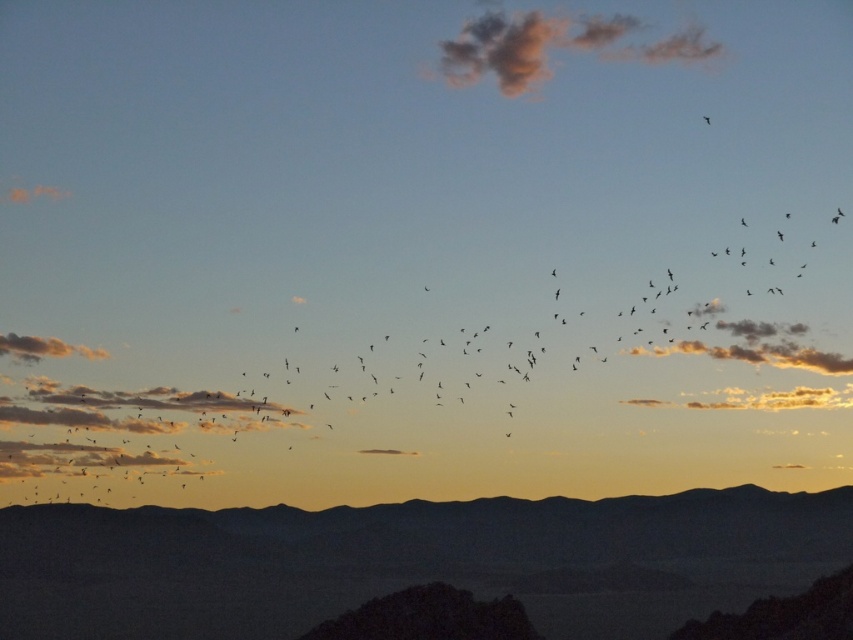
From the picture: You are an artist trying to paint the landscape. You want to ensure the silhouetted rock at lower center and the soft pink cotton cloud at upper center are proportionally accurate. Based on their positions in the image, which object should you draw smaller in your painting?

The silhouetted rock at lower center has a lesser height compared to the soft pink cotton cloud at upper center, so you should draw the silhouetted rock at lower center smaller than the soft pink cotton cloud at upper center.

You are an artist painting the sky and want to ensure the soft pink cotton cloud at upper center and the dark gray textured cloud at right are to scale. Which cloud should you draw first if you want to place them proportionally?

The soft pink cotton cloud at upper center should be drawn first since it is smaller than the dark gray textured cloud at right, allowing you to allocate space for the larger cloud afterward.

You are an airplane pilot flying at an altitude of 10,000 feet. You notice two clouds in the sky, the soft pink cotton cloud at upper center and the dark gray textured cloud at right. Which cloud is higher in the sky?

The soft pink cotton cloud at upper center has a greater height compared to the dark gray textured cloud at right, so the soft pink cotton cloud at upper center is higher in the sky.